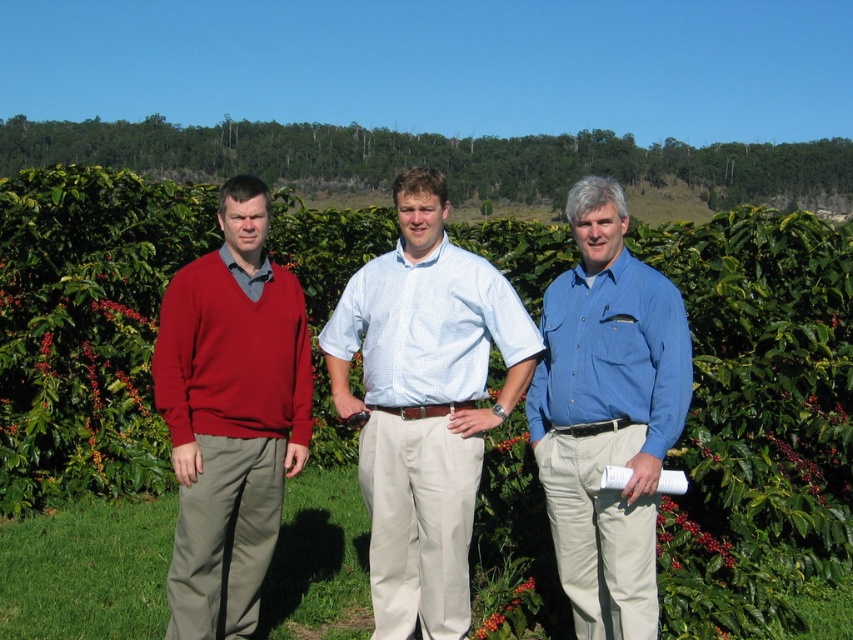
Between green leafy vines at center and matte red sweater at left, which one is positioned higher?

green leafy vines at center

What do you see at coordinates (757, 419) in the screenshot? I see `green leafy vines at center` at bounding box center [757, 419].

Which is behind, point (666, 538) or point (201, 384)?

Positioned behind is point (666, 538).

I want to click on green leafy vines at center, so click(x=757, y=419).

Can you confirm if light blue checkered shirt at center is positioned above blue cotton shirt at center?

Yes.

Does point (438, 480) come in front of point (595, 188)?

No, it is behind (595, 188).

Image resolution: width=853 pixels, height=640 pixels. Identify the location of light blue checkered shirt at center. (424, 404).

Who is positioned more to the right, green leafy vines at center or blue cotton shirt at center?

From the viewer's perspective, blue cotton shirt at center appears more on the right side.

Who is shorter, green leafy vines at center or blue cotton shirt at center?

Standing shorter between the two is blue cotton shirt at center.

Locate an element on the screen. The image size is (853, 640). green leafy vines at center is located at coordinates (757, 419).